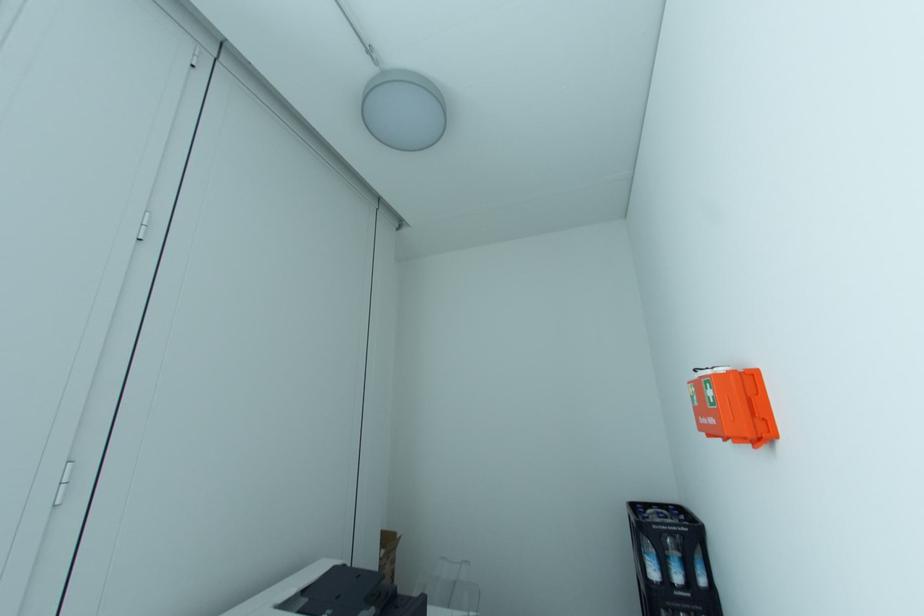
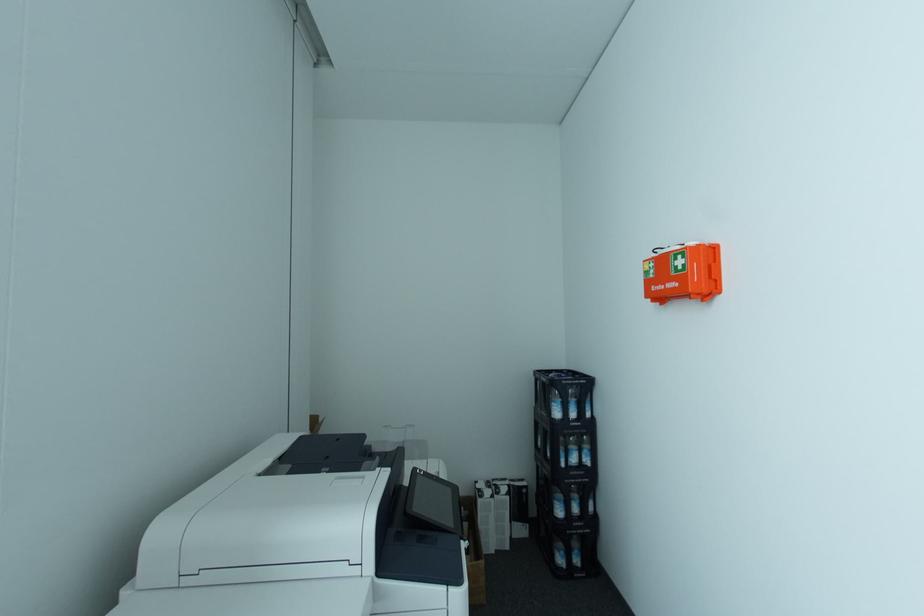
Question: The images are taken continuously from a first-person perspective. In which direction is your viewpoint rotating?

Choices:
 (A) Left
 (B) Right
 (C) Up
 (D) Down

Answer: (B)